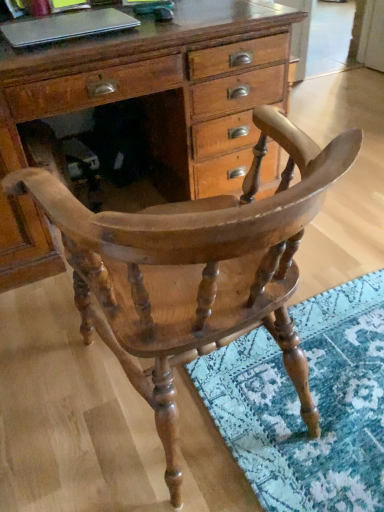
Question: In terms of height, does silver metallic laptop at upper left look taller or shorter compared to wooden chest of drawers at center?

Choices:
 (A) tall
 (B) short

Answer: (B)

Question: Considering the relative positions of silver metallic laptop at upper left and wooden chest of drawers at center in the image provided, is silver metallic laptop at upper left to the left or to the right of wooden chest of drawers at center?

Choices:
 (A) right
 (B) left

Answer: (B)

Question: Estimate the real-world distances between objects in this image. Which object is closer to the wooden chest of drawers at center?

Choices:
 (A) silver metallic laptop at upper left
 (B) wooden chair at center

Answer: (A)

Question: Considering the real-world distances, which object is closest to the silver metallic laptop at upper left?

Choices:
 (A) wooden chair at center
 (B) wooden chest of drawers at center

Answer: (B)